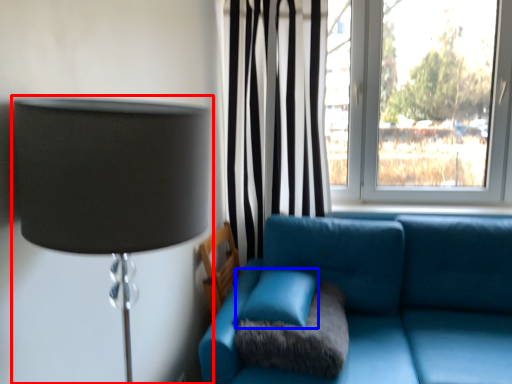
Question: Among these objects, which one is farthest to the camera, lamp (highlighted by a red box) or turquoise (highlighted by a blue box)?

Choices:
 (A) lamp
 (B) turquoise

Answer: (B)